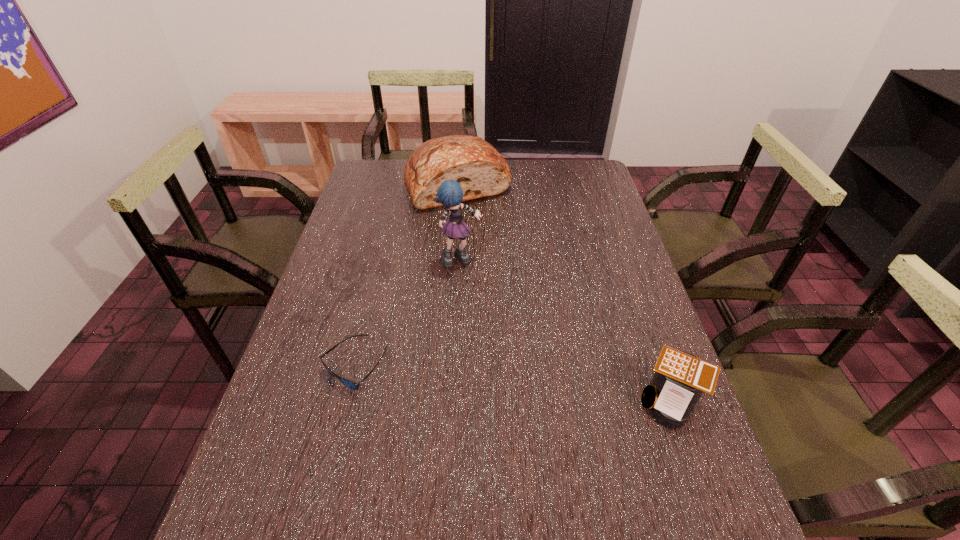
Identify the location of vacant space on the desktop that is between the sunglasses and the third tallest object and is positioned on the front-facing side of the rag doll. This screenshot has width=960, height=540. pyautogui.click(x=554, y=387).

Where is `vacant spot on the desktop that is between the shortest object and the second shortest object and is positioned at the sliced front of the farthest object`? This screenshot has width=960, height=540. vacant spot on the desktop that is between the shortest object and the second shortest object and is positioned at the sliced front of the farthest object is located at coordinates (543, 386).